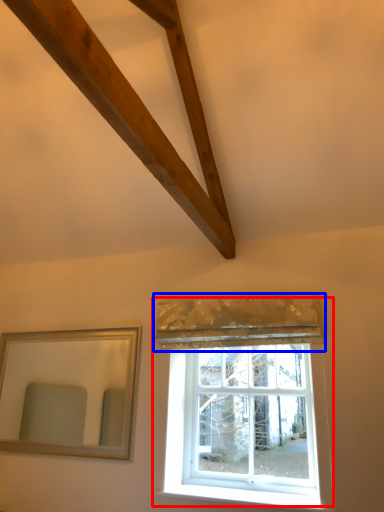
Question: Which object is further to the camera taking this photo, window (highlighted by a red box) or curtain (highlighted by a blue box)?

Choices:
 (A) window
 (B) curtain

Answer: (A)